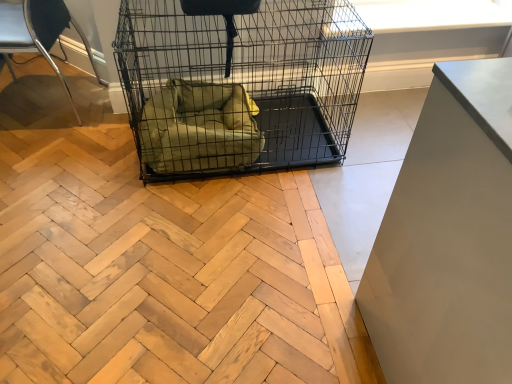
I want to click on free space on the front side of metallic silver chair at left, so click(x=48, y=155).